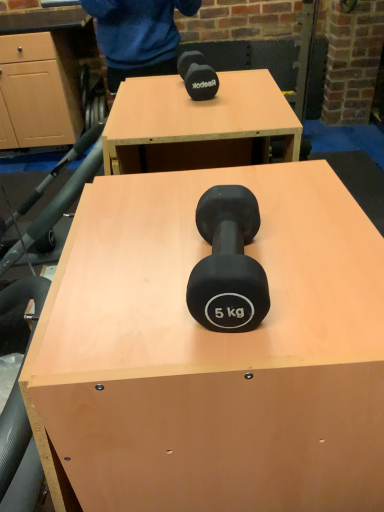
Question: Visually, is matte black dumbbell at center positioned to the left or to the right of black rubber dumbbell at center?

Choices:
 (A) right
 (B) left

Answer: (B)

Question: From the image's perspective, is matte black dumbbell at center positioned above or below black rubber dumbbell at center?

Choices:
 (A) below
 (B) above

Answer: (A)

Question: Would you say matte black dumbbell at center is inside or outside black rubber dumbbell at center?

Choices:
 (A) outside
 (B) inside

Answer: (A)

Question: In terms of width, does black rubber dumbbell at center look wider or thinner when compared to matte black dumbbell at center?

Choices:
 (A) wide
 (B) thin

Answer: (B)

Question: Does point (235, 206) appear closer or farther from the camera than point (150, 196)?

Choices:
 (A) farther
 (B) closer

Answer: (B)

Question: Would you say black rubber dumbbell at center is to the left or to the right of matte black dumbbell at center in the picture?

Choices:
 (A) left
 (B) right

Answer: (B)

Question: Looking at the image, does black rubber dumbbell at center seem bigger or smaller compared to matte black dumbbell at center?

Choices:
 (A) big
 (B) small

Answer: (B)